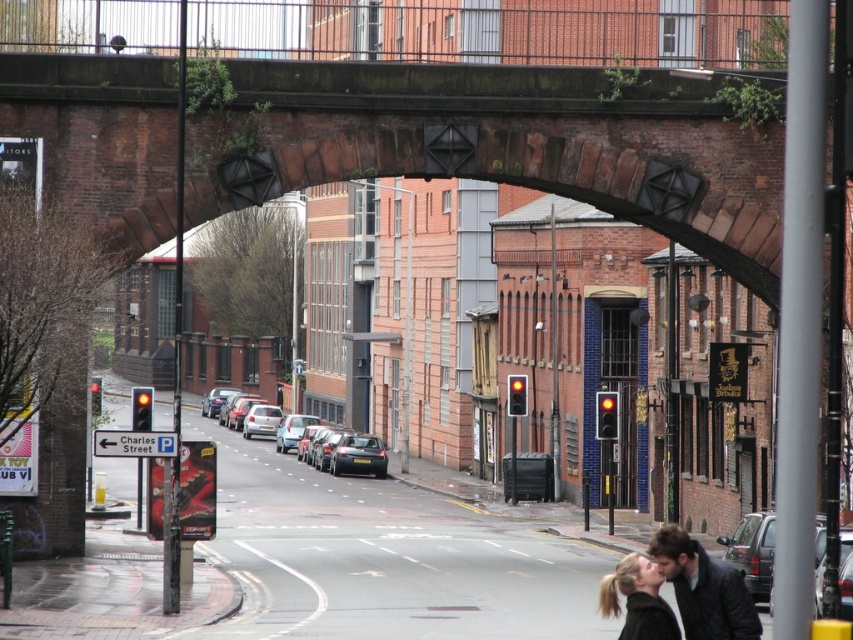
Which is in front, point (718, 580) or point (647, 582)?

Point (647, 582)

Does point (718, 634) come in front of point (607, 584)?

No, (718, 634) is further to viewer.

Where is `dark brown leather jacket at lower right`? dark brown leather jacket at lower right is located at coordinates (704, 588).

Can you confirm if brick archway at center is shorter than dark brown leather jacket at lower right?

No.

Does brick archway at center appear over dark brown leather jacket at lower right?

Correct, brick archway at center is located above dark brown leather jacket at lower right.

Image resolution: width=853 pixels, height=640 pixels. In order to click on brick archway at center in this screenshot , I will do `click(517, 144)`.

The width and height of the screenshot is (853, 640). I want to click on brick archway at center, so click(x=517, y=144).

Who is more distant from viewer, (701, 209) or (643, 611)?

The point (701, 209) is behind.

The width and height of the screenshot is (853, 640). I want to click on brick archway at center, so click(x=517, y=144).

The height and width of the screenshot is (640, 853). Describe the element at coordinates (517, 144) in the screenshot. I see `brick archway at center` at that location.

In order to click on brick archway at center in this screenshot , I will do `click(517, 144)`.